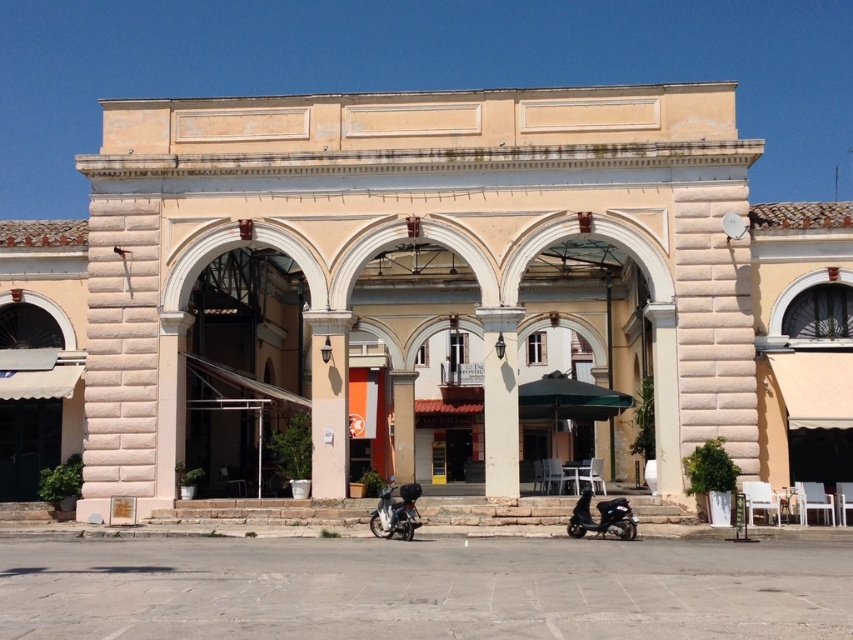
Is shiny black scooter at lower center further to the viewer compared to metallic silver scooter at center?

No, it is not.

Does shiny black scooter at lower center have a lesser height compared to metallic silver scooter at center?

Yes.

Which is in front, point (589, 529) or point (374, 524)?

Point (589, 529) is in front.

The height and width of the screenshot is (640, 853). What are the coordinates of `shiny black scooter at lower center` in the screenshot? It's located at (601, 516).

Which is more to the right, white stone column at center or metallic silver scooter at center?

Positioned to the right is white stone column at center.

Locate an element on the screen. This screenshot has width=853, height=640. white stone column at center is located at coordinates (500, 401).

Is white stone column at center positioned in front of shiny black scooter at lower center?

No, white stone column at center is further to the viewer.

Who is more distant from viewer, (496, 372) or (618, 508)?

Positioned behind is point (496, 372).

Does point (488, 468) come in front of point (582, 513)?

No.

The height and width of the screenshot is (640, 853). I want to click on white stone column at center, so click(x=500, y=401).